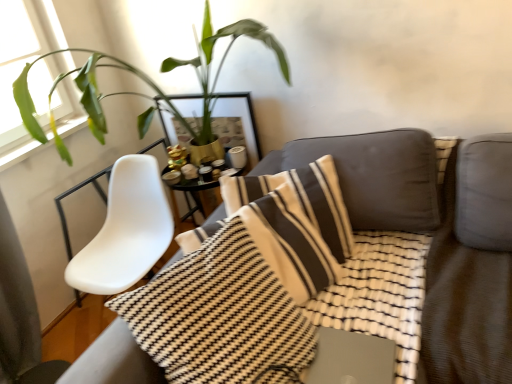
Question: From the image's perspective, is gold metallic picture frame at upper center on top of green leafy plant at upper left?

Choices:
 (A) yes
 (B) no

Answer: (B)

Question: Is gold metallic picture frame at upper center at the right side of green leafy plant at upper left?

Choices:
 (A) no
 (B) yes

Answer: (B)

Question: Does gold metallic picture frame at upper center have a lesser height compared to green leafy plant at upper left?

Choices:
 (A) yes
 (B) no

Answer: (A)

Question: Is gold metallic picture frame at upper center thinner than green leafy plant at upper left?

Choices:
 (A) yes
 (B) no

Answer: (A)

Question: From a real-world perspective, is gold metallic picture frame at upper center located beneath green leafy plant at upper left?

Choices:
 (A) no
 (B) yes

Answer: (B)

Question: From the image's perspective, is gold metallic picture frame at upper center beneath green leafy plant at upper left?

Choices:
 (A) yes
 (B) no

Answer: (A)

Question: Does metallic silver laptop at center have a lesser width compared to green leafy plant at upper left?

Choices:
 (A) no
 (B) yes

Answer: (B)

Question: Is green leafy plant at upper left inside metallic silver laptop at center?

Choices:
 (A) no
 (B) yes

Answer: (A)

Question: Is metallic silver laptop at center facing towards green leafy plant at upper left?

Choices:
 (A) yes
 (B) no

Answer: (B)

Question: Is metallic silver laptop at center shorter than green leafy plant at upper left?

Choices:
 (A) yes
 (B) no

Answer: (A)

Question: Is metallic silver laptop at center further to the viewer compared to green leafy plant at upper left?

Choices:
 (A) no
 (B) yes

Answer: (A)

Question: Is metallic silver laptop at center positioned in front of green leafy plant at upper left?

Choices:
 (A) yes
 (B) no

Answer: (A)

Question: Is metallic silver laptop at center positioned with its back to gold metallic picture frame at upper center?

Choices:
 (A) no
 (B) yes

Answer: (A)